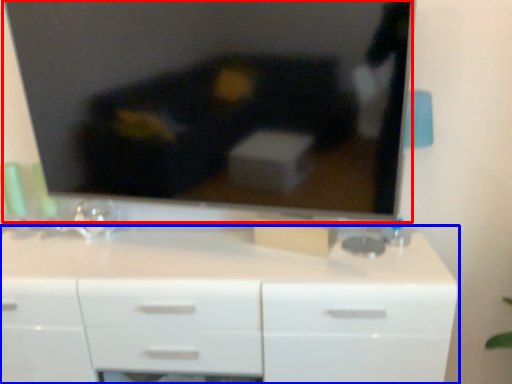
Question: Among these objects, which one is nearest to the camera, television (highlighted by a red box) or chest of drawers (highlighted by a blue box)?

Choices:
 (A) television
 (B) chest of drawers

Answer: (A)